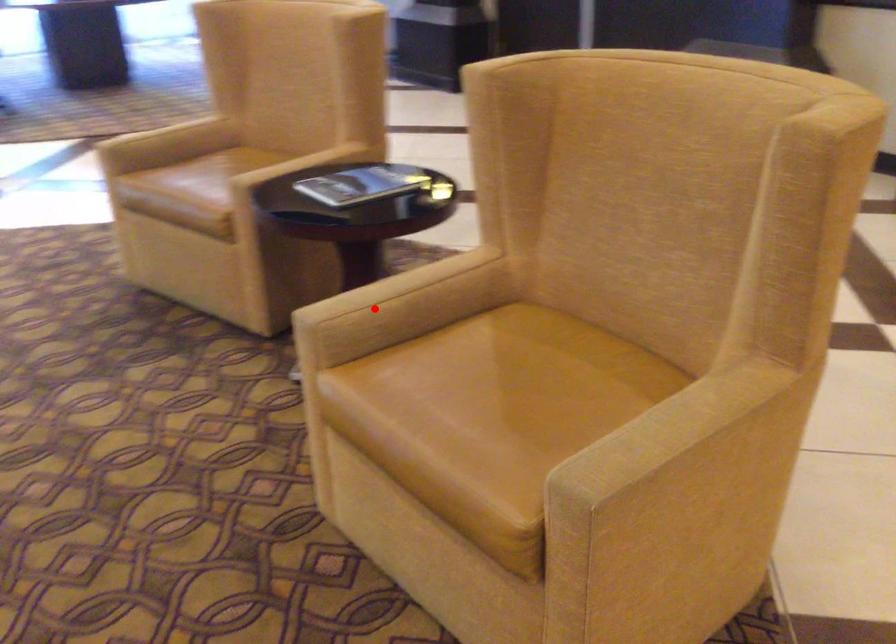
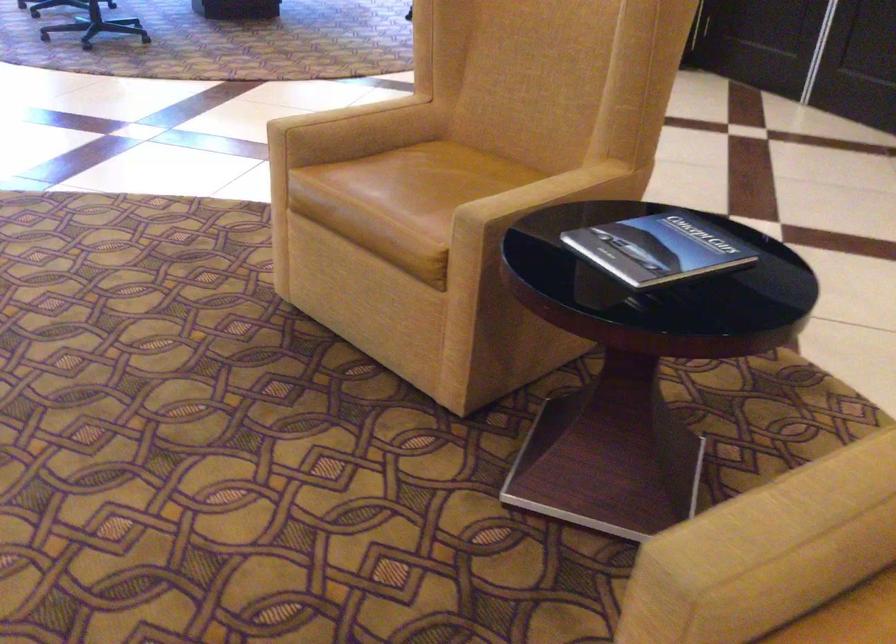
In the second image, find the point that corresponds to the highlighted location in the first image.

(778, 543)